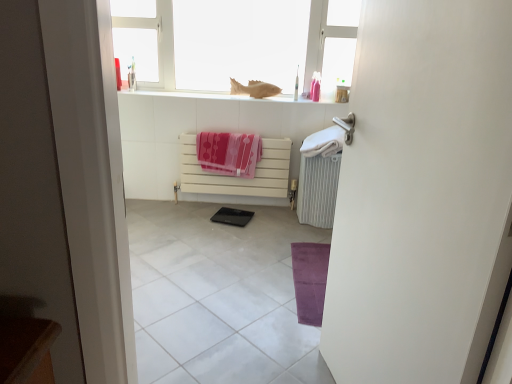
This screenshot has height=384, width=512. Find the location of `vacant space underneath purple velvety yoga mat at lower right (from a real-world perspective)`. vacant space underneath purple velvety yoga mat at lower right (from a real-world perspective) is located at coordinates (311, 270).